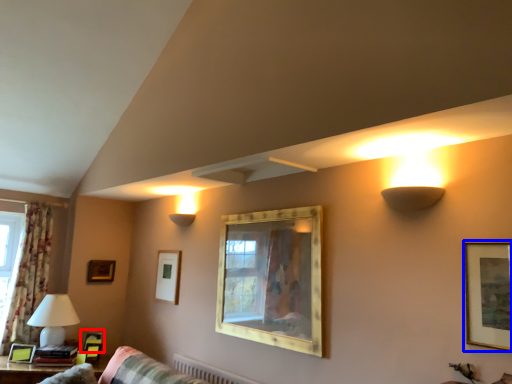
Question: Which object is closer to the camera taking this photo, picture frame (highlighted by a red box) or picture frame (highlighted by a blue box)?

Choices:
 (A) picture frame
 (B) picture frame

Answer: (B)